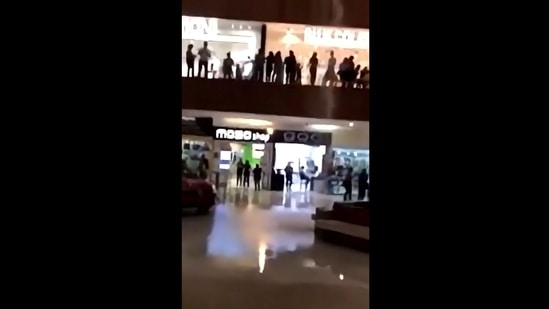
At what (x,y) coordinates should I click in order to perform the action: click on table. Please return your answer as a coordinate pair (x, y). The image size is (549, 309). Looking at the image, I should click on (196, 189).